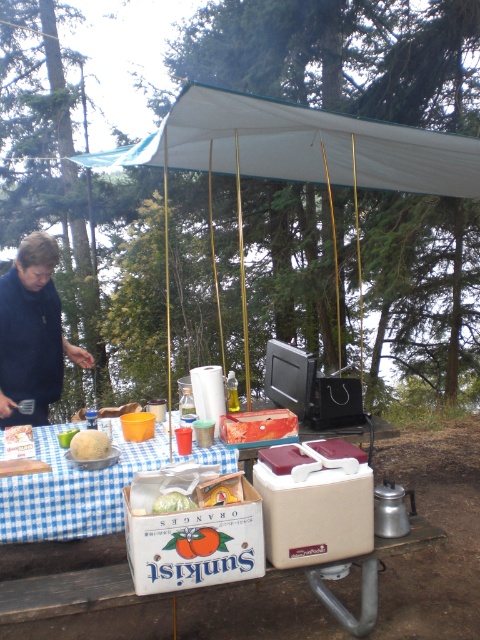
You are setting up a picnic table and need to place a decorative centerpiece exactly halfway between the blue checkered tablecloth at lower left and the orange printed cardboard box at center. What is the minimum distance you need to measure from either object to position the centerpiece correctly?

The blue checkered tablecloth at lower left is 29.81 inches from the orange printed cardboard box at center. To place the centerpiece exactly halfway, you would measure 14.9 inches from either object.

You are setting up a picnic table and need to place a decorative centerpiece. The instructions say to put it on the tablecloth that is to the left of the dark blue fabric. Which tablecloth should you choose between the blue checkered tablecloth at lower left and the dark blue fabric at left?

The dark blue fabric at left is to the right of the blue checkered tablecloth at lower left, so the blue checkered tablecloth at lower left is to the left of the dark blue fabric at left. Therefore, you should place the centerpiece on the blue checkered tablecloth at lower left.